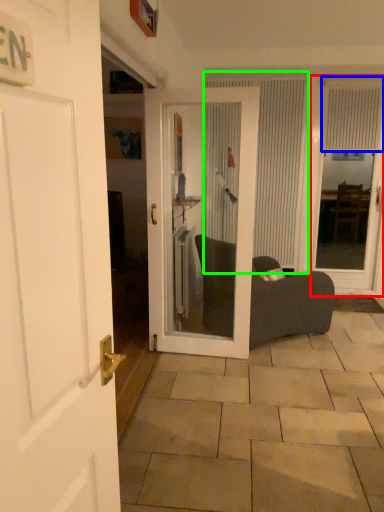
Question: Which is farther away from glass door (highlighted by a red box)? curtain (highlighted by a blue box) or curtain (highlighted by a green box)?

Choices:
 (A) curtain
 (B) curtain

Answer: (B)